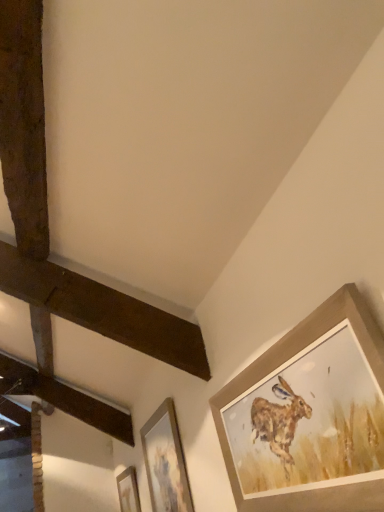
Question: Are wooden picture frame at lower center, which is the 1th picture frame from back to front, and wooden picture frame at center, the second picture frame when ordered from top to bottom, beside each other?

Choices:
 (A) yes
 (B) no

Answer: (B)

Question: Considering the relative positions of wooden picture frame at lower center, the 3th picture frame viewed from the right, and wooden picture frame at center, the second picture frame when ordered from top to bottom, in the image provided, is wooden picture frame at lower center, the 3th picture frame viewed from the right, to the right of wooden picture frame at center, the second picture frame when ordered from top to bottom, from the viewer's perspective?

Choices:
 (A) yes
 (B) no

Answer: (B)

Question: From a real-world perspective, is wooden picture frame at lower center, placed as the first picture frame when sorted from bottom to top, beneath wooden picture frame at center, which appears as the 2th picture frame when viewed from the front?

Choices:
 (A) yes
 (B) no

Answer: (A)

Question: Is wooden picture frame at center, placed as the second picture frame when sorted from left to right, located within wooden picture frame at lower center, the 3th picture frame viewed from the right?

Choices:
 (A) yes
 (B) no

Answer: (B)

Question: From a real-world perspective, is wooden picture frame at lower center, which is the first picture frame in left-to-right order, over wooden picture frame at center, the 2th picture frame from the right?

Choices:
 (A) no
 (B) yes

Answer: (A)

Question: In terms of height, does wooden picture frame at lower center, positioned as the third picture frame in top-to-bottom order, look taller or shorter compared to wooden picture frame at upper right, which is the 3th picture frame from bottom to top?

Choices:
 (A) tall
 (B) short

Answer: (B)

Question: Is wooden picture frame at lower center, positioned as the third picture frame in top-to-bottom order, spatially inside wooden picture frame at upper right, marked as the 3th picture frame in a back-to-front arrangement, or outside of it?

Choices:
 (A) inside
 (B) outside

Answer: (B)

Question: Visually, is wooden picture frame at lower center, placed as the first picture frame when sorted from bottom to top, positioned to the left or to the right of wooden picture frame at upper right, marked as the 3th picture frame in a back-to-front arrangement?

Choices:
 (A) left
 (B) right

Answer: (A)

Question: From a real-world perspective, is wooden picture frame at lower center, which is the 1th picture frame from back to front, positioned above or below wooden picture frame at upper right, the third picture frame positioned from the left?

Choices:
 (A) below
 (B) above

Answer: (B)

Question: Visually, is wooden picture frame at upper right, marked as the 3th picture frame in a back-to-front arrangement, positioned to the left or to the right of wooden picture frame at lower center, positioned as the third picture frame in top-to-bottom order?

Choices:
 (A) left
 (B) right

Answer: (B)

Question: Considering the positions of point tap(322, 329) and point tap(135, 500), is point tap(322, 329) closer or farther from the camera than point tap(135, 500)?

Choices:
 (A) farther
 (B) closer

Answer: (B)

Question: Is wooden picture frame at upper right, placed as the 1th picture frame when sorted from top to bottom, inside the boundaries of wooden picture frame at lower center, which is the 1th picture frame from back to front, or outside?

Choices:
 (A) outside
 (B) inside

Answer: (A)

Question: From their relative heights in the image, would you say wooden picture frame at upper right, acting as the first picture frame starting from the right, is taller or shorter than wooden picture frame at lower center, which is the first picture frame in left-to-right order?

Choices:
 (A) tall
 (B) short

Answer: (A)

Question: Considering the positions of wooden picture frame at center, placed as the second picture frame when sorted from left to right, and wooden picture frame at lower center, the 3th picture frame viewed from the right, in the image, is wooden picture frame at center, placed as the second picture frame when sorted from left to right, bigger or smaller than wooden picture frame at lower center, the 3th picture frame viewed from the right,?

Choices:
 (A) big
 (B) small

Answer: (A)

Question: From a real-world perspective, is wooden picture frame at center, placed as the second picture frame when sorted from left to right, physically located above or below wooden picture frame at lower center, the 3th picture frame viewed from the right?

Choices:
 (A) above
 (B) below

Answer: (A)